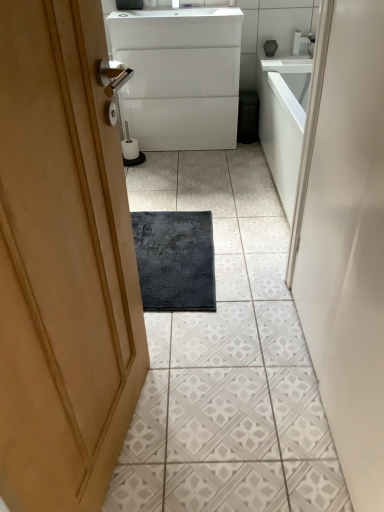
Question: In terms of height, does white glossy tap at upper center look taller or shorter compared to white textured tile at center?

Choices:
 (A) short
 (B) tall

Answer: (B)

Question: From the image's perspective, is white glossy tap at upper center positioned above or below white textured tile at center?

Choices:
 (A) above
 (B) below

Answer: (A)

Question: Which object is positioned farthest from the white glossy tap at upper center?

Choices:
 (A) white glossy countertop at upper center
 (B) polished brass door handle at upper center
 (C) white textured tile at center
 (D) white glossy faucet at upper center
 (E) white glossy cabinet at center

Answer: (B)

Question: Estimate the real-world distances between objects in this image. Which object is farther from the white textured tile at center?

Choices:
 (A) white glossy countertop at upper center
 (B) white glossy cabinet at center
 (C) white glossy tap at upper center
 (D) white glossy faucet at upper center
 (E) polished brass door handle at upper center

Answer: (D)